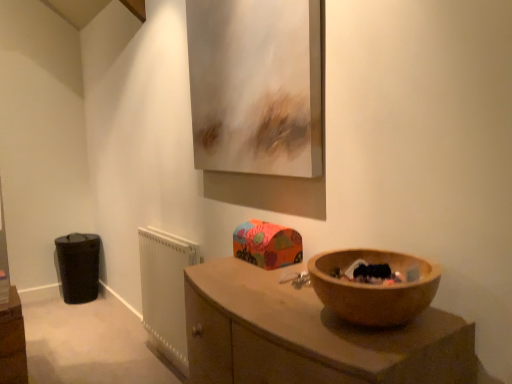
Question: From a real-world perspective, is white plastic radiator at lower left physically located above or below black fabric bag at lower left?

Choices:
 (A) above
 (B) below

Answer: (A)

Question: In terms of width, does white plastic radiator at lower left look wider or thinner when compared to black fabric bag at lower left?

Choices:
 (A) wide
 (B) thin

Answer: (B)

Question: Based on their relative distances, which object is farther from the metallic silver picture frame at upper center?

Choices:
 (A) black fabric bag at lower left
 (B) wooden at lower right
 (C) white plastic radiator at lower left

Answer: (A)

Question: Which object is positioned farthest from the black fabric bag at lower left?

Choices:
 (A) metallic silver picture frame at upper center
 (B) wooden at lower right
 (C) white plastic radiator at lower left

Answer: (B)